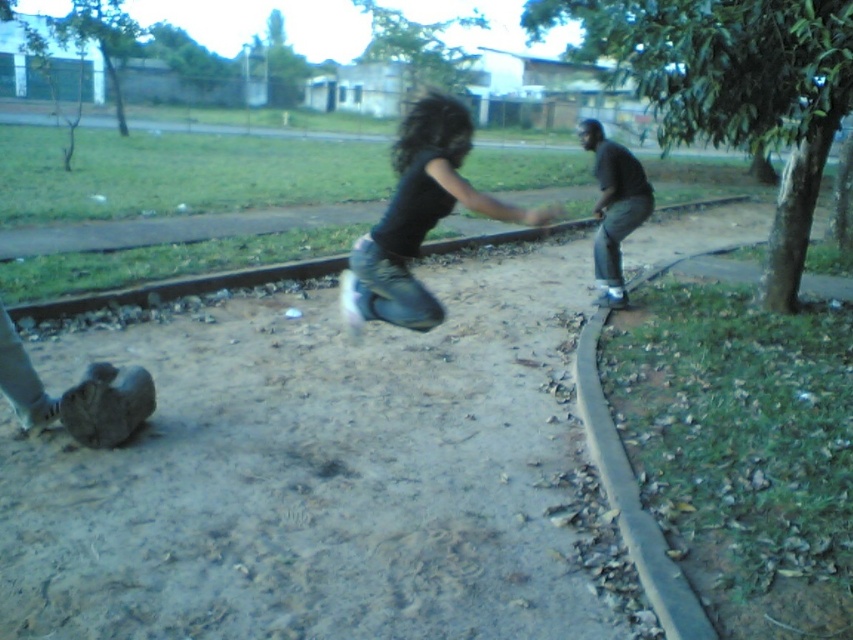
Is green leafy tree at right above black matte pants at center?

Correct, green leafy tree at right is located above black matte pants at center.

Based on the photo, which is below, green leafy tree at right or black matte pants at center?

black matte pants at center is lower down.

Which is behind, point (622, 3) or point (645, 214)?

Point (622, 3)

Image resolution: width=853 pixels, height=640 pixels. Identify the location of green leafy tree at right. (730, 86).

Does green leafy tree at upper center have a lesser width compared to green leafy tree at upper left?

Yes.

In the scene shown: Is green leafy tree at upper center bigger than green leafy tree at upper left?

Actually, green leafy tree at upper center might be smaller than green leafy tree at upper left.

At what (x,y) coordinates should I click in order to perform the action: click on green leafy tree at upper center. Please return your answer as a coordinate pair (x, y). This screenshot has width=853, height=640. Looking at the image, I should click on (419, 49).

Where is `green leafy tree at upper center`? This screenshot has width=853, height=640. green leafy tree at upper center is located at coordinates (419, 49).

Which is in front, point (764, 106) or point (413, 180)?

Point (413, 180)

How distant is green leafy tree at right from black matte jeans at center?

They are 27.78 feet apart.

Does point (788, 232) lie in front of point (428, 193)?

No, (788, 232) is behind (428, 193).

The width and height of the screenshot is (853, 640). What are the coordinates of `green leafy tree at right` in the screenshot? It's located at click(730, 86).